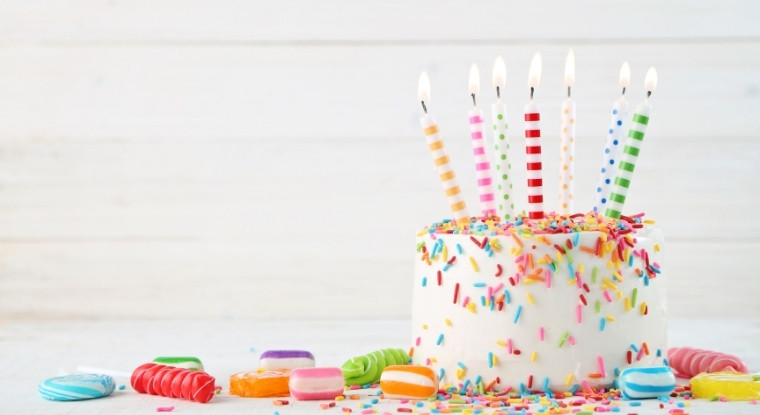
Identify the location of birthday candles. (451, 179), (486, 175), (502, 169), (532, 175), (567, 167), (609, 166), (622, 174).